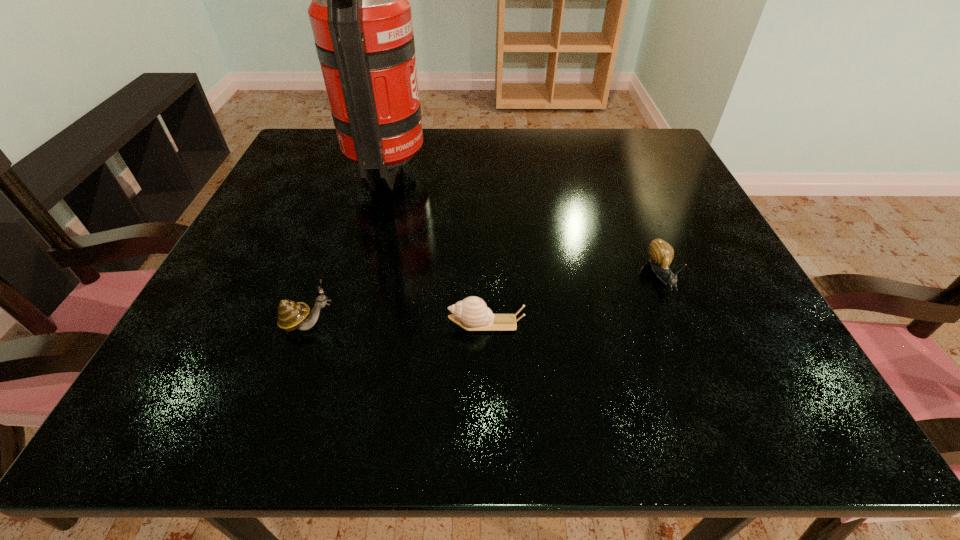
You are a GUI agent. You are given a task and a screenshot of the screen. Output one action in this format:
    pyautogui.click(x=<x>, y=<y>)
    Task: Click on the vacant space situated on the shell of the second escargot from right to left
    The height and width of the screenshot is (540, 960).
    Given the screenshot: What is the action you would take?
    pyautogui.click(x=357, y=323)

Identify the location of vacant space located on the shell of the second escargot from right to left. (319, 323).

The width and height of the screenshot is (960, 540). I want to click on free space located on the shell of the second escargot from right to left, so click(208, 323).

Locate an element on the screen. object situated at the far edge is located at coordinates (360, 16).

This screenshot has width=960, height=540. In order to click on fire extinguisher located at the left edge in this screenshot , I will do `click(360, 16)`.

The image size is (960, 540). I want to click on snail situated at the left edge, so click(291, 315).

This screenshot has height=540, width=960. What are the coordinates of `object located in the right edge section of the desktop` in the screenshot? It's located at (661, 253).

Find the location of a particular element. object located in the far left corner section of the desktop is located at coordinates (360, 16).

This screenshot has height=540, width=960. I want to click on vacant region at the far edge of the desktop, so click(x=360, y=174).

This screenshot has width=960, height=540. In the image, there is a desktop. What are the coordinates of `vacant region at the near edge` in the screenshot? It's located at (386, 402).